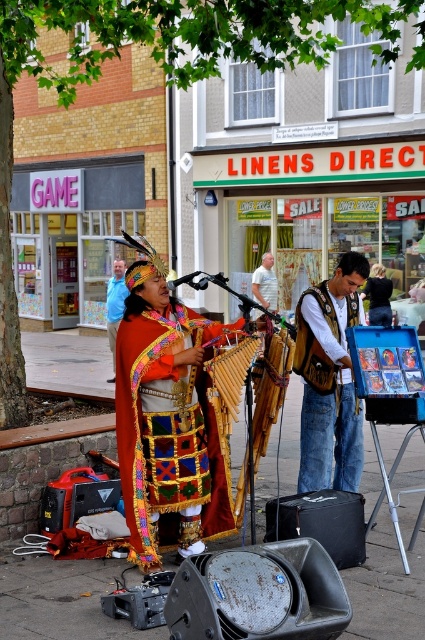
Question: Does leather vest at center come behind light blue t-shirt at center?

Choices:
 (A) no
 (B) yes

Answer: (A)

Question: Does leather vest at center have a smaller size compared to light blue t-shirt at center?

Choices:
 (A) yes
 (B) no

Answer: (A)

Question: Which point appears farthest from the camera in this image?

Choices:
 (A) (272, 300)
 (B) (116, 422)
 (C) (387, 316)
 (D) (326, 365)

Answer: (A)

Question: Does blue fabric shirt at center have a greater width compared to light blue t-shirt at center?

Choices:
 (A) no
 (B) yes

Answer: (A)

Question: Among these objects, which one is nearest to the camera?

Choices:
 (A) matte multicolored poncho at center
 (B) leather vest at center

Answer: (A)

Question: Which object appears farthest from the camera in this image?

Choices:
 (A) leather vest at center
 (B) light blue t-shirt at center
 (C) matte multicolored poncho at center

Answer: (B)